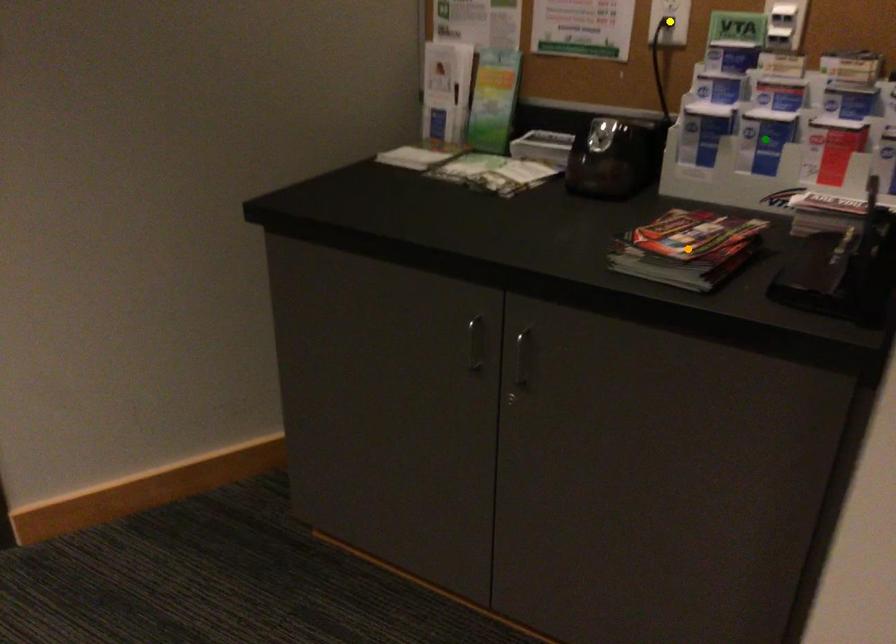
Order these from nearest to farthest:
A) yellow point
B) orange point
C) green point

orange point, green point, yellow point